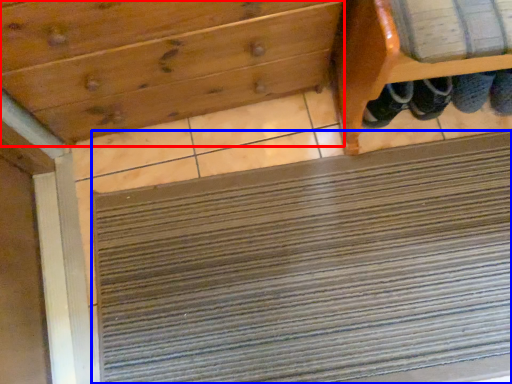
Question: Which of the following is the closest to the observer, drawer (highlighted by a red box) or doormat (highlighted by a blue box)?

Choices:
 (A) drawer
 (B) doormat

Answer: (A)